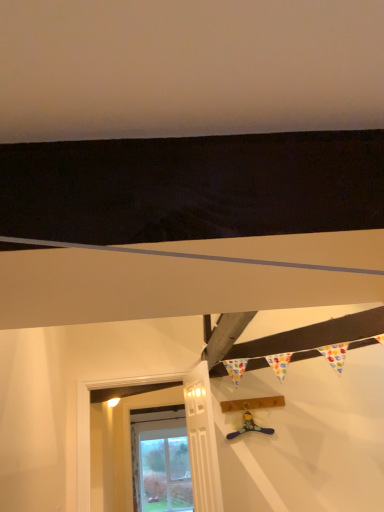
Question: Is white painted wood door at lower left located within white painted wood at lower left?

Choices:
 (A) no
 (B) yes

Answer: (A)

Question: Is white painted wood at lower left taller than white painted wood door at lower left?

Choices:
 (A) yes
 (B) no

Answer: (A)

Question: Does white painted wood at lower left appear on the right side of white painted wood door at lower left?

Choices:
 (A) yes
 (B) no

Answer: (B)

Question: Are white painted wood at lower left and white painted wood door at lower left far apart?

Choices:
 (A) yes
 (B) no

Answer: (A)

Question: Considering the relative sizes of white painted wood at lower left and white painted wood door at lower left in the image provided, is white painted wood at lower left wider than white painted wood door at lower left?

Choices:
 (A) no
 (B) yes

Answer: (B)

Question: Would you say white painted wood door at lower left is to the left or to the right of white painted wood at lower left in the picture?

Choices:
 (A) left
 (B) right

Answer: (B)

Question: Considering the positions of point (192, 454) and point (107, 489), is point (192, 454) closer or farther from the camera than point (107, 489)?

Choices:
 (A) farther
 (B) closer

Answer: (B)

Question: Considering the positions of white painted wood door at lower left and white painted wood at lower left in the image, is white painted wood door at lower left bigger or smaller than white painted wood at lower left?

Choices:
 (A) small
 (B) big

Answer: (A)

Question: Considering their positions, is white painted wood door at lower left located in front of or behind white painted wood at lower left?

Choices:
 (A) front
 (B) behind

Answer: (A)

Question: Would you say blue fabric toy at center is to the left or to the right of white painted wood door at lower left in the picture?

Choices:
 (A) right
 (B) left

Answer: (A)

Question: Considering the positions of blue fabric toy at center and white painted wood door at lower left in the image, is blue fabric toy at center bigger or smaller than white painted wood door at lower left?

Choices:
 (A) big
 (B) small

Answer: (B)

Question: Considering their positions, is blue fabric toy at center located in front of or behind white painted wood door at lower left?

Choices:
 (A) front
 (B) behind

Answer: (B)

Question: Is blue fabric toy at center wider or thinner than white painted wood door at lower left?

Choices:
 (A) thin
 (B) wide

Answer: (A)

Question: Considering their positions, is white painted wood at lower left located in front of or behind white painted wood door at lower left?

Choices:
 (A) front
 (B) behind

Answer: (B)

Question: From the image's perspective, relative to white painted wood door at lower left, is white painted wood at lower left above or below?

Choices:
 (A) above
 (B) below

Answer: (B)